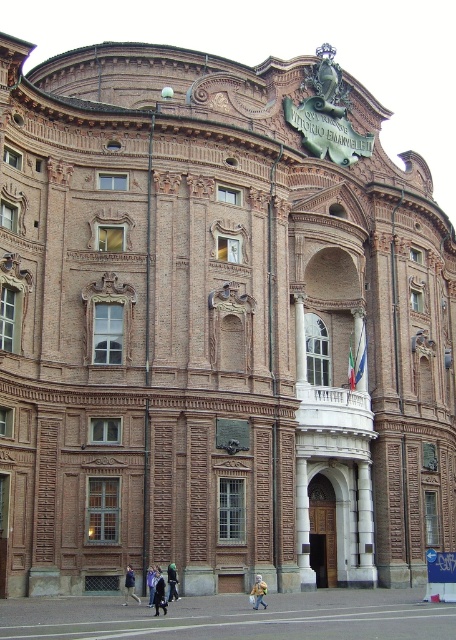
Image resolution: width=456 pixels, height=640 pixels. In order to click on yellow plastic bag at center in this screenshot , I will do `click(259, 593)`.

Does yellow plastic bag at center appear on the left side of dark blue jeans at lower center?

No, yellow plastic bag at center is not to the left of dark blue jeans at lower center.

This screenshot has width=456, height=640. What do you see at coordinates (259, 593) in the screenshot?
I see `yellow plastic bag at center` at bounding box center [259, 593].

I want to click on yellow plastic bag at center, so click(259, 593).

The height and width of the screenshot is (640, 456). Describe the element at coordinates (129, 586) in the screenshot. I see `dark blue jacket at lower center` at that location.

Does point (134, 582) lie behind point (149, 570)?

No, (134, 582) is in front of (149, 570).

At what (x,y) coordinates should I click in order to perform the action: click on dark blue jacket at lower center. Please return your answer as a coordinate pair (x, y). The height and width of the screenshot is (640, 456). Looking at the image, I should click on (129, 586).

I want to click on dark blue jacket at lower center, so click(x=129, y=586).

Between dark blue jacket at lower center and light blue denim jacket at lower center, which one appears on the right side from the viewer's perspective?

light blue denim jacket at lower center is more to the right.

Find the location of `dark blue jacket at lower center`. dark blue jacket at lower center is located at coordinates (129, 586).